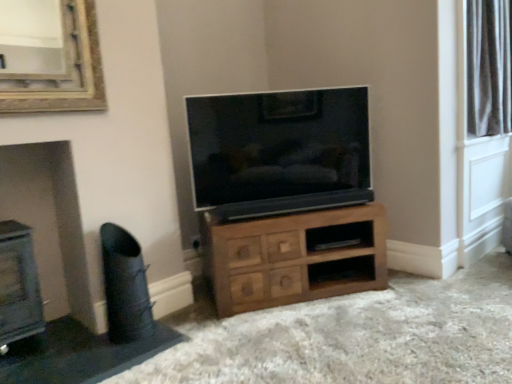
This screenshot has width=512, height=384. What are the coordinates of `vacant space that is to the left of black leather swivel chair at lower left` in the screenshot? It's located at tap(80, 345).